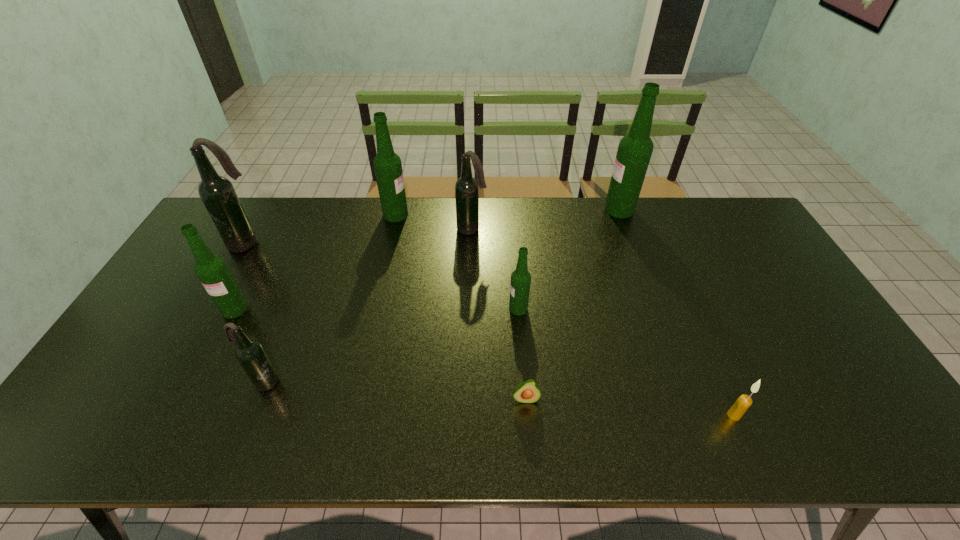
The image size is (960, 540). What are the coordinates of `the nearest dark beer bottle` in the screenshot? It's located at (250, 353).

This screenshot has width=960, height=540. Identify the location of the third object from left to right. (250, 353).

Find the location of a particular element. This screenshot has height=540, width=960. cream candle is located at coordinates (744, 401).

Where is `candle`? The height and width of the screenshot is (540, 960). candle is located at coordinates (744, 401).

Locate an element on the screen. green avocado is located at coordinates tap(528, 391).

Identify the location of avocado. (528, 391).

You are a GUI agent. You are given a task and a screenshot of the screen. Output one action in this format:
    pyautogui.click(x=<x>, y=<y>)
    Task: Click on the free space located 0.070m on the label of the rightmost beer bottle
    The width and height of the screenshot is (960, 540).
    Given the screenshot: What is the action you would take?
    tap(586, 210)

At what (x,y) coordinates should I click in order to perform the action: click on free space located on the label of the rightmost beer bottle. Please return your answer as a coordinate pair (x, y). Looking at the image, I should click on (580, 210).

Image resolution: width=960 pixels, height=540 pixels. What are the coordinates of `vacant region located 0.070m on the label of the rightmost beer bottle` in the screenshot? It's located at (586, 210).

Locate an element on the screen. The width and height of the screenshot is (960, 540). free spot located 0.160m on the label of the third smallest green beer bottle is located at coordinates (453, 214).